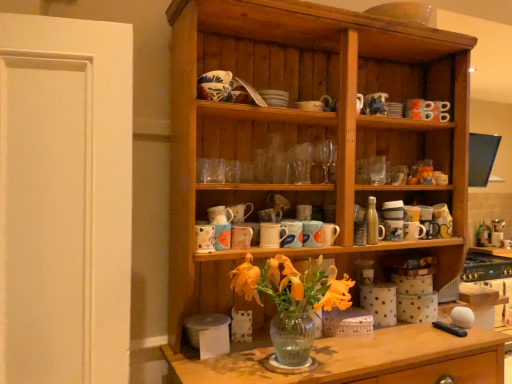
The image size is (512, 384). I want to click on matte ceramic mug at upper center, which is the fifth tableware from top to bottom, so click(x=312, y=233).

Measure the distance between matte ceramic mug at upper right, the first tableware from the right, and camera.

matte ceramic mug at upper right, the first tableware from the right, is 5.99 feet from camera.

Describe the element at coordinates (329, 234) in the screenshot. The image size is (512, 384). I see `matte ceramic mug at center, placed as the seventh tableware when sorted from left to right` at that location.

What is the approximate height of white matte door at left?

white matte door at left is 3.73 feet in height.

This screenshot has width=512, height=384. I want to click on matte ceramic mug at upper center, the third tableware from the right, so click(312, 233).

Is wooden cabinet at center oriented away from metallic silver bottle at center-right?

Correct, wooden cabinet at center is looking away from metallic silver bottle at center-right.

Is wooden cabinet at center closer to the viewer compared to metallic silver bottle at center-right?

Yes, wooden cabinet at center is closer to the camera.

Considering the points (234, 2) and (373, 244), which point is behind, point (234, 2) or point (373, 244)?

The point (373, 244) is farther from the camera.

Between matte ceramic mug at upper center, which is the fifth tableware from top to bottom, and matte ceramic mug at center, which is counted as the third tableware, starting from the left, which one has larger size?

With larger size is matte ceramic mug at upper center, which is the fifth tableware from top to bottom.

Considering the positions of objects matte ceramic mug at upper center, positioned as the 4th tableware in bottom-to-top order, and matte ceramic mug at center, which is the 7th tableware from top to bottom, in the image provided, who is more to the right, matte ceramic mug at upper center, positioned as the 4th tableware in bottom-to-top order, or matte ceramic mug at center, which is the 7th tableware from top to bottom,?

matte ceramic mug at upper center, positioned as the 4th tableware in bottom-to-top order.

Which object is thinner, matte ceramic mug at upper center, the third tableware from the right, or matte ceramic mug at center, which is the 6th tableware in right-to-left order?

matte ceramic mug at upper center, the third tableware from the right, is thinner.

From the image's perspective, is matte ceramic mug at upper center, the third tableware from the right, located beneath matte ceramic mug at center, which is the 7th tableware from top to bottom?

No, from the image's perspective, matte ceramic mug at upper center, the third tableware from the right, is not beneath matte ceramic mug at center, which is the 7th tableware from top to bottom.

Can you confirm if blue and white ceramic mug at center, the 4th tableware positioned from the right, is positioned to the right of matte ceramic mug at upper center, marked as the sixth tableware in a left-to-right arrangement?

In fact, blue and white ceramic mug at center, the 4th tableware positioned from the right, is to the left of matte ceramic mug at upper center, marked as the sixth tableware in a left-to-right arrangement.

In the scene shown: Is blue and white ceramic mug at center, the fourth tableware in the top-to-bottom sequence, wider or thinner than matte ceramic mug at upper center, positioned as the 4th tableware in bottom-to-top order?

Clearly, blue and white ceramic mug at center, the fourth tableware in the top-to-bottom sequence, has more width compared to matte ceramic mug at upper center, positioned as the 4th tableware in bottom-to-top order.

Based on the photo, is blue and white ceramic mug at center, which appears as the 5th tableware when viewed from the left, in contact with matte ceramic mug at upper center, the third tableware from the right?

Yes, blue and white ceramic mug at center, which appears as the 5th tableware when viewed from the left, is next to matte ceramic mug at upper center, the third tableware from the right.

In the scene shown: Which is more distant, (x=301, y=245) or (x=248, y=234)?

Point (x=248, y=234)

Who is bigger, blue and white ceramic mug at center, which is the 5th tableware from bottom to top, or matte ceramic mug at center, which is counted as the third tableware, starting from the left?

With larger size is blue and white ceramic mug at center, which is the 5th tableware from bottom to top.

Is blue and white ceramic mug at center, the 4th tableware positioned from the right, aimed at matte ceramic mug at center, arranged as the 2th tableware when ordered from the bottom?

No, blue and white ceramic mug at center, the 4th tableware positioned from the right, does not turn towards matte ceramic mug at center, arranged as the 2th tableware when ordered from the bottom.

How different are the orientations of metallic silver bottle at center-right and white matte door at left in degrees?

The angle between the facing direction of metallic silver bottle at center-right and the facing direction of white matte door at left is 12.6 degrees.

Is metallic silver bottle at center-right touching white matte door at left?

metallic silver bottle at center-right and white matte door at left are clearly separated.

Is metallic silver bottle at center-right thinner than white matte door at left?

Yes.

How many degrees apart are the facing directions of matte ceramic mug at upper right, the eighth tableware from the left, and metallic silver bottle at center-right?

They differ by 0.00556 degrees in their facing directions.

Based on the photo, is matte ceramic mug at upper right, the eighth tableware from the left, wider or thinner than metallic silver bottle at center-right?

In the image, matte ceramic mug at upper right, the eighth tableware from the left, appears to be wider than metallic silver bottle at center-right.

Who is shorter, matte ceramic mug at upper right, placed as the eighth tableware when sorted from bottom to top, or metallic silver bottle at center-right?

With less height is matte ceramic mug at upper right, placed as the eighth tableware when sorted from bottom to top.

This screenshot has width=512, height=384. There is a metallic silver bottle at center-right. Identify the location of the 2nd tableware above it (from a real-world perspective). (375, 104).

From the image's perspective, which one is positioned higher, blue and white ceramic mug at center, the 4th tableware positioned from the right, or white ceramic mug at center, which is counted as the fifth tableware, starting from the right?

white ceramic mug at center, which is counted as the fifth tableware, starting from the right.

Which object is further away from the camera, blue and white ceramic mug at center, which is the 5th tableware from bottom to top, or white ceramic mug at center, which is counted as the fifth tableware, starting from the right?

blue and white ceramic mug at center, which is the 5th tableware from bottom to top, is more distant.

Considering the relative sizes of blue and white ceramic mug at center, which appears as the 5th tableware when viewed from the left, and white ceramic mug at center, arranged as the fourth tableware when viewed from the left, in the image provided, is blue and white ceramic mug at center, which appears as the 5th tableware when viewed from the left, smaller than white ceramic mug at center, arranged as the fourth tableware when viewed from the left,?

Yes.

Considering the relative sizes of blue and white ceramic mug at center, the fourth tableware in the top-to-bottom sequence, and white ceramic mug at center, which is counted as the fifth tableware, starting from the right, in the image provided, is blue and white ceramic mug at center, the fourth tableware in the top-to-bottom sequence, shorter than white ceramic mug at center, which is counted as the fifth tableware, starting from the right,?

In fact, blue and white ceramic mug at center, the fourth tableware in the top-to-bottom sequence, may be taller than white ceramic mug at center, which is counted as the fifth tableware, starting from the right.

Locate an element on the screen. This screenshot has height=384, width=512. bottle lying behind the wooden cabinet at center is located at coordinates coord(373,223).

Where is `the 4th tableware directly beneath the matte ceramic mug at upper center, the third tableware from the right (from a real-world perspective)`? the 4th tableware directly beneath the matte ceramic mug at upper center, the third tableware from the right (from a real-world perspective) is located at coordinates (241, 237).

In the scene shown: Considering their positions, is white ceramic mug at center, arranged as the fourth tableware when viewed from the left, positioned further to metallic silver bottle at center-right than wooden cabinet at center?

wooden cabinet at center lies further to metallic silver bottle at center-right than the other object.

When comparing their distances from matte ceramic mug at center, which is the 2th tableware from right to left, does white ceramic mug at center, arranged as the fourth tableware when viewed from the left, or matte ceramic mug at center, which is counted as the third tableware, starting from the left, seem closer?

white ceramic mug at center, arranged as the fourth tableware when viewed from the left, is closer to matte ceramic mug at center, which is the 2th tableware from right to left.

Looking at the image, which one is located closer to blue and white ceramic mug at center, the 4th tableware positioned from the right, wooden cabinet at center or metallic silver bottle at center-right?

metallic silver bottle at center-right is closer to blue and white ceramic mug at center, the 4th tableware positioned from the right.

Considering their positions, is metallic silver bottle at center-right positioned closer to matte ceramic mug at upper center, which is the fifth tableware from top to bottom, than matte ceramic mug at upper right, acting as the 1th tableware starting from the top?

Among the two, metallic silver bottle at center-right is located nearer to matte ceramic mug at upper center, which is the fifth tableware from top to bottom.

Based on their spatial positions, is wooden cabinet at center or blue and white ceramic mug at center, which appears as the 5th tableware when viewed from the left, further from white matte door at left?

Based on the image, blue and white ceramic mug at center, which appears as the 5th tableware when viewed from the left, appears to be further to white matte door at left.

Looking at the image, which one is located closer to white ceramic mug at center, arranged as the fourth tableware when viewed from the left, metallic silver bottle at center-right or matte ceramic mug at center, which is counted as the first tableware, starting from the bottom?

matte ceramic mug at center, which is counted as the first tableware, starting from the bottom, lies closer to white ceramic mug at center, arranged as the fourth tableware when viewed from the left, than the other object.

Estimate the real-world distances between objects in this image. Which object is closer to matte ceramic mug at upper center, which is the fifth tableware from top to bottom, matte ceramic mug at center, the eighth tableware from the right, or blue and white ceramic mug at center, the fourth tableware in the top-to-bottom sequence?

Among the two, blue and white ceramic mug at center, the fourth tableware in the top-to-bottom sequence, is located nearer to matte ceramic mug at upper center, which is the fifth tableware from top to bottom.

When comparing their distances from matte ceramic mug at upper right, placed as the eighth tableware when sorted from bottom to top, does white matte door at left or metallic silver bottle at center-right seem closer?

The object closer to matte ceramic mug at upper right, placed as the eighth tableware when sorted from bottom to top, is metallic silver bottle at center-right.

Image resolution: width=512 pixels, height=384 pixels. Find the location of `cabinetry located between white matte door at left and metallic silver bottle at center-right in the left-right direction`. cabinetry located between white matte door at left and metallic silver bottle at center-right in the left-right direction is located at coordinates (307, 133).

The width and height of the screenshot is (512, 384). Find the location of `bottle between wooden cabinet at center and matte ceramic mug at upper right, the eighth tableware from the left, from front to back`. bottle between wooden cabinet at center and matte ceramic mug at upper right, the eighth tableware from the left, from front to back is located at coordinates (373, 223).

Find the location of `tableware between matte ceramic mug at center, which is the 6th tableware in right-to-left order, and blue and white ceramic mug at center, the fourth tableware in the top-to-bottom sequence, from left to right`. tableware between matte ceramic mug at center, which is the 6th tableware in right-to-left order, and blue and white ceramic mug at center, the fourth tableware in the top-to-bottom sequence, from left to right is located at coordinates (272, 235).

At what (x,y) coordinates should I click in order to perform the action: click on tableware between white matte door at left and matte ceramic mug at center, the second tableware when ordered from left to right. Please return your answer as a coordinate pair (x, y). This screenshot has height=384, width=512. Looking at the image, I should click on (205, 238).